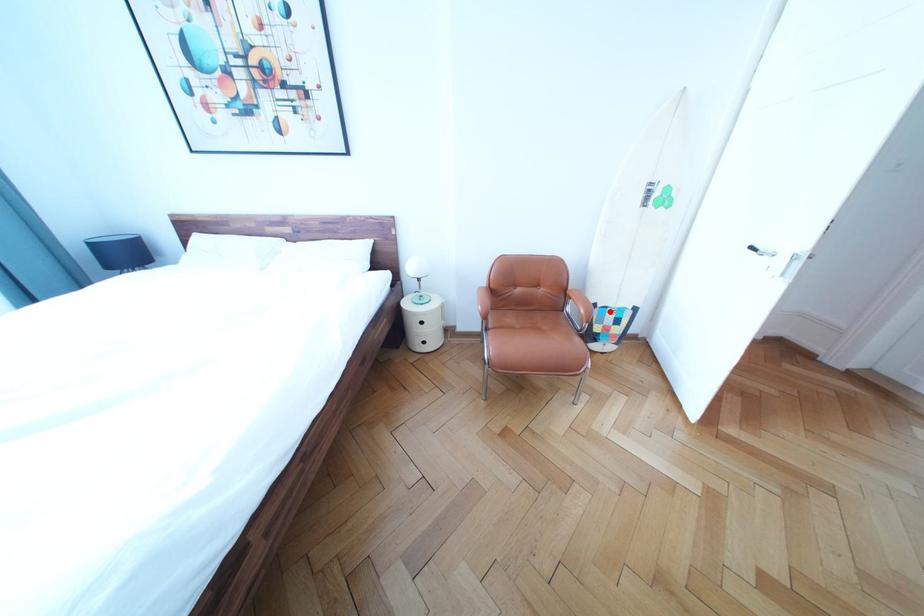
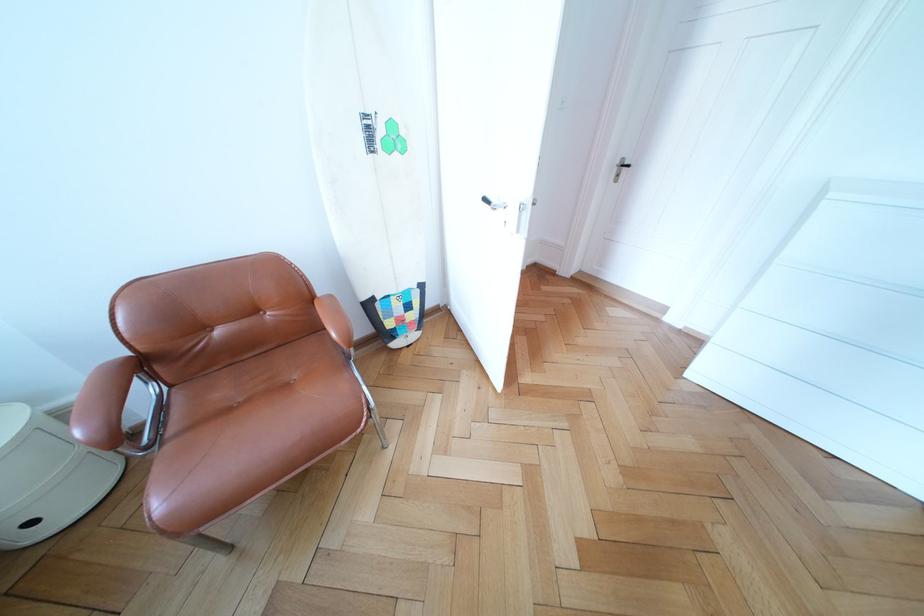
Question: I am providing you with two images of the same scene from different viewpoints. Given a red point in image1, look at the same physical point in image2. Is it:

Choices:
 (A) Closer to the viewpoint
 (B) Farther from the viewpoint

Answer: (A)